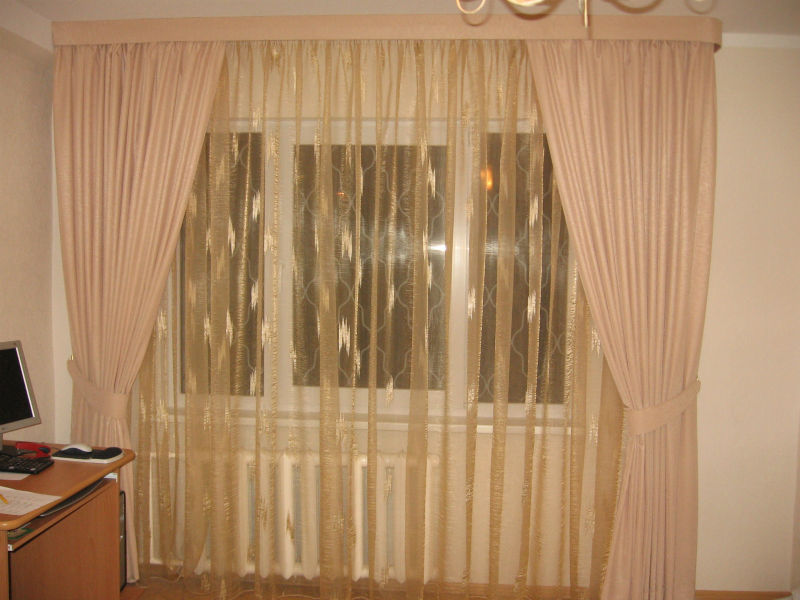
Identify the location of brown floor. This screenshot has height=600, width=800. (741, 595), (150, 585).